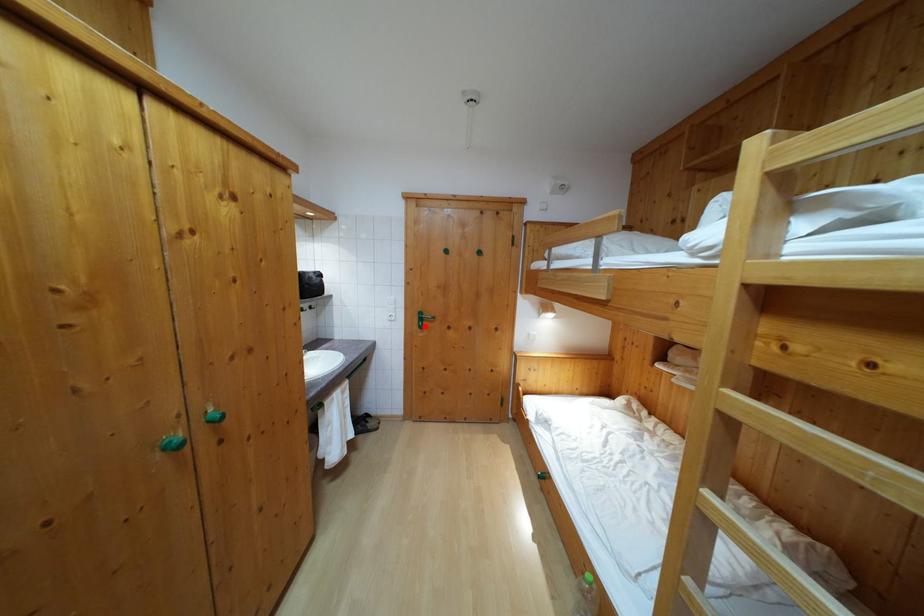
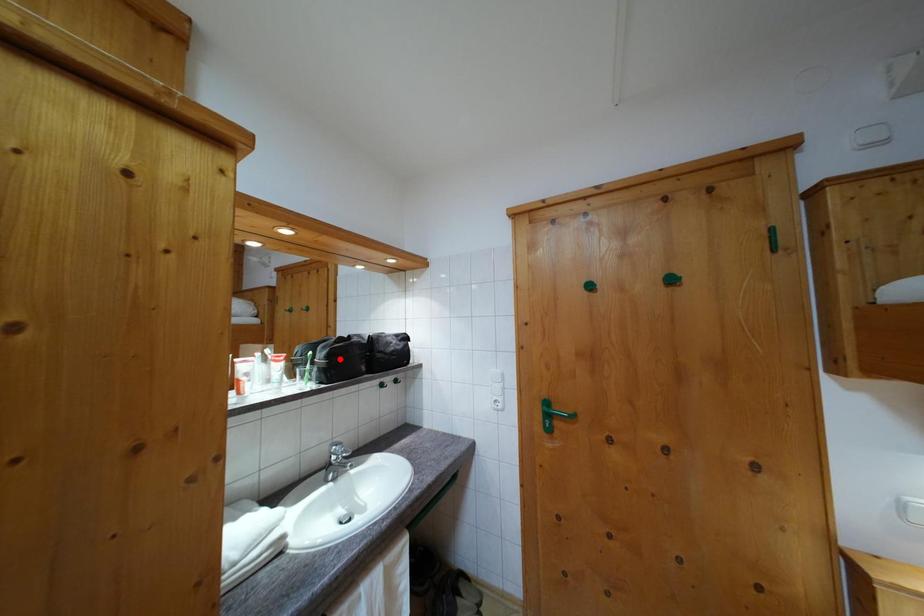
I am providing you with two images of the same scene from different viewpoints. A red point is marked on the first image and another point is marked on the second image. Do the highlighted points in image1 and image2 indicate the same real-world spot?

No